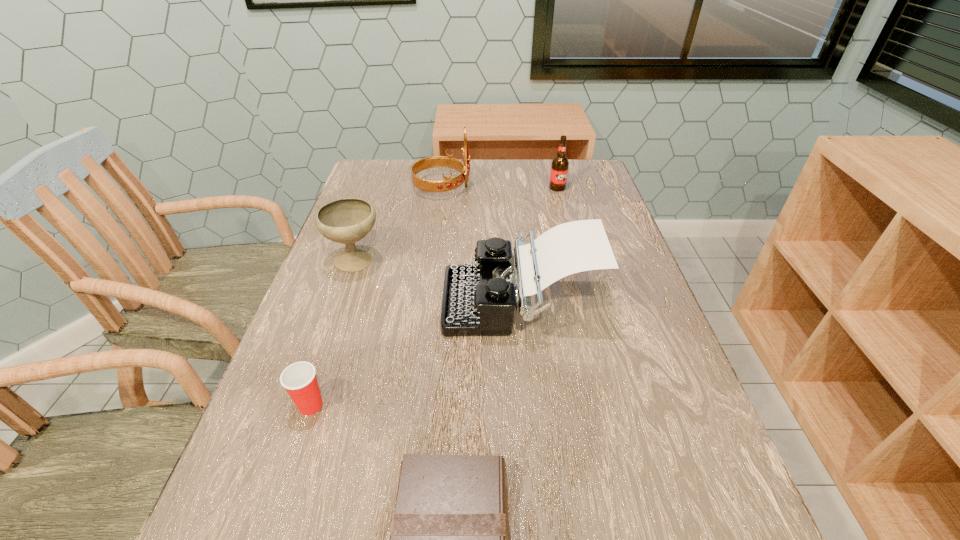
Where is `the third closest object to the chalice`? the third closest object to the chalice is located at coordinates (299, 379).